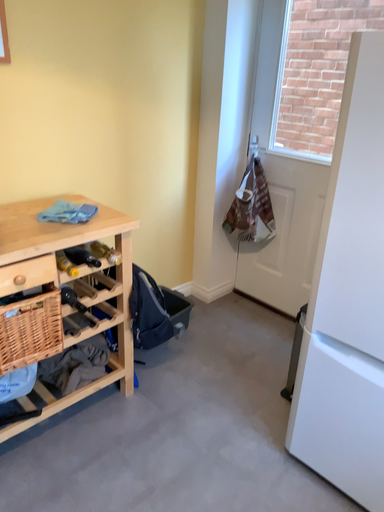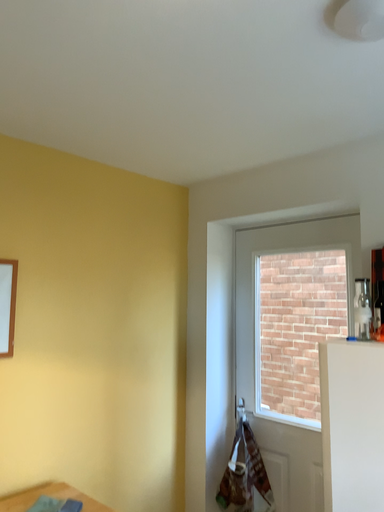
Question: How did the camera likely rotate when shooting the video?

Choices:
 (A) rotated upward
 (B) rotated downward

Answer: (A)